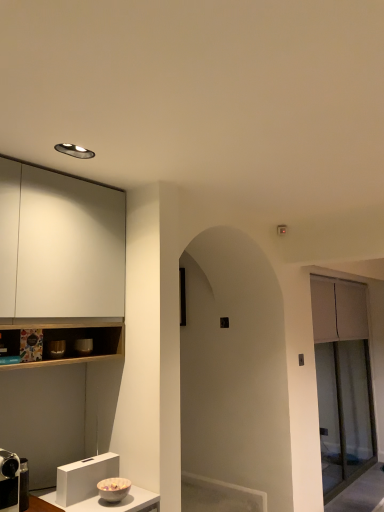
Describe the element at coordinates (83, 346) in the screenshot. This screenshot has width=384, height=512. I see `matte ceramic bowl at left, placed as the first appliance when sorted from back to front` at that location.

At what (x,y) coordinates should I click in order to perform the action: click on metallic silver camera at lower left, the 3th appliance from the back. Please return your answer as a coordinate pair (x, y). Image resolution: width=384 pixels, height=512 pixels. Looking at the image, I should click on point(13,482).

Does metallic silver camera at lower left, the 3th appliance from the right, appear on the right side of matte ceramic bowl at left, arranged as the 1th appliance when viewed from the right?

No, metallic silver camera at lower left, the 3th appliance from the right, is not to the right of matte ceramic bowl at left, arranged as the 1th appliance when viewed from the right.

From the picture: Does metallic silver camera at lower left, the 3th appliance from the back, come in front of matte ceramic bowl at left, acting as the 2th appliance starting from the bottom?

Yes, it is.

You are a GUI agent. You are given a task and a screenshot of the screen. Output one action in this format:
    pyautogui.click(x=<x>, y=<y>)
    Task: Click on the appliance below the matte ceramic bowl at left, placed as the first appliance when sorted from back to front (from the image's perspective)
    This screenshot has height=512, width=384.
    Given the screenshot: What is the action you would take?
    pyautogui.click(x=13, y=482)

Which is in front, point (8, 502) or point (54, 344)?

The point (8, 502) is closer.

Considering the sizes of metallic silver camera at lower left, the 3th appliance from the right, and matte silver bowl at left, the second appliance positioned from the back, in the image, is metallic silver camera at lower left, the 3th appliance from the right, wider or thinner than matte silver bowl at left, the second appliance positioned from the back,?

Clearly, metallic silver camera at lower left, the 3th appliance from the right, has more width compared to matte silver bowl at left, the second appliance positioned from the back.

Who is shorter, metallic silver camera at lower left, arranged as the first appliance when ordered from the bottom, or matte silver bowl at left, which appears as the second appliance when viewed from the left?

With less height is matte silver bowl at left, which appears as the second appliance when viewed from the left.

Is metallic silver camera at lower left, arranged as the first appliance when ordered from the bottom, in front of or behind matte silver bowl at left, acting as the 3th appliance starting from the bottom, in the image?

Clearly, metallic silver camera at lower left, arranged as the first appliance when ordered from the bottom, is in front of matte silver bowl at left, acting as the 3th appliance starting from the bottom.

Locate an element on the screen. the 3rd appliance in front of the clear glass screen door at right, counting from the anchor's position is located at coordinates (13, 482).

Is clear glass screen door at right not inside metallic silver camera at lower left, the 3th appliance from the back?

Indeed, clear glass screen door at right is completely outside metallic silver camera at lower left, the 3th appliance from the back.

From the picture: From a real-world perspective, who is located lower, clear glass screen door at right or metallic silver camera at lower left, which is the first appliance in front-to-back order?

From a 3D spatial view, metallic silver camera at lower left, which is the first appliance in front-to-back order, is below.

How far apart are matte ceramic bowl at left, arranged as the 3th appliance when viewed from the left, and metallic silver camera at lower left, the third appliance from the top?

matte ceramic bowl at left, arranged as the 3th appliance when viewed from the left, is 60.75 centimeters away from metallic silver camera at lower left, the third appliance from the top.

From the image's perspective, which object appears higher, matte ceramic bowl at left, placed as the first appliance when sorted from back to front, or metallic silver camera at lower left, which is the first appliance in front-to-back order?

matte ceramic bowl at left, placed as the first appliance when sorted from back to front.

Is matte ceramic bowl at left, acting as the 2th appliance starting from the bottom, positioned with its back to metallic silver camera at lower left, which is the first appliance in front-to-back order?

matte ceramic bowl at left, acting as the 2th appliance starting from the bottom, does not have its back to metallic silver camera at lower left, which is the first appliance in front-to-back order.

From the picture: From a real-world perspective, who is located lower, matte ceramic bowl at left, acting as the 2th appliance starting from the bottom, or metallic silver camera at lower left, the third appliance from the top?

metallic silver camera at lower left, the third appliance from the top.

Choose the correct answer: Is clear glass screen door at right inside matte silver bowl at left, acting as the 3th appliance starting from the bottom, or outside it?

The correct answer is: outside.

From the image's perspective, which object appears higher, clear glass screen door at right or matte silver bowl at left, the 2th appliance from the front?

matte silver bowl at left, the 2th appliance from the front, from the image's perspective.

Considering the relative sizes of clear glass screen door at right and matte silver bowl at left, the 2th appliance from the front, in the image provided, is clear glass screen door at right bigger than matte silver bowl at left, the 2th appliance from the front,?

Yes, clear glass screen door at right is bigger than matte silver bowl at left, the 2th appliance from the front.

In the scene shown: Is clear glass screen door at right facing towards matte silver bowl at left, the second appliance positioned from the back?

No, clear glass screen door at right does not turn towards matte silver bowl at left, the second appliance positioned from the back.

Which of these two, matte ceramic bowl at left, acting as the third appliance starting from the front, or clear glass screen door at right, is bigger?

clear glass screen door at right.

Considering the sizes of objects matte ceramic bowl at left, arranged as the 1th appliance when viewed from the right, and clear glass screen door at right in the image provided, who is thinner, matte ceramic bowl at left, arranged as the 1th appliance when viewed from the right, or clear glass screen door at right?

Thinner between the two is matte ceramic bowl at left, arranged as the 1th appliance when viewed from the right.

Who is shorter, matte ceramic bowl at left, acting as the 2th appliance starting from the bottom, or clear glass screen door at right?

matte ceramic bowl at left, acting as the 2th appliance starting from the bottom, is shorter.

Is matte ceramic bowl at left, arranged as the 3th appliance when viewed from the left, oriented towards clear glass screen door at right?

No, matte ceramic bowl at left, arranged as the 3th appliance when viewed from the left, is not aimed at clear glass screen door at right.

Looking at their sizes, would you say matte silver bowl at left, the 2th appliance from the front, is wider or thinner than metallic silver camera at lower left, the third appliance from the top?

matte silver bowl at left, the 2th appliance from the front, is thinner than metallic silver camera at lower left, the third appliance from the top.

Image resolution: width=384 pixels, height=512 pixels. I want to click on the 2nd appliance below the matte silver bowl at left, which appears as the second appliance when viewed from the left (from a real-world perspective), so click(x=13, y=482).

Considering the sizes of objects matte silver bowl at left, the second appliance positioned from the back, and metallic silver camera at lower left, which is the first appliance in front-to-back order, in the image provided, who is bigger, matte silver bowl at left, the second appliance positioned from the back, or metallic silver camera at lower left, which is the first appliance in front-to-back order,?

metallic silver camera at lower left, which is the first appliance in front-to-back order.

In the image, there is a matte ceramic bowl at left, placed as the first appliance when sorted from back to front. At what (x,y) coordinates should I click in order to perform the action: click on appliance below it (from the image's perspective). Please return your answer as a coordinate pair (x, y). Looking at the image, I should click on (13, 482).

From the image's perspective, starting from the metallic silver camera at lower left, the first appliance viewed from the left, which appliance is the 2nd one above? Please provide its 2D coordinates.

[(57, 349)]

Estimate the real-world distances between objects in this image. Which object is further from metallic silver camera at lower left, arranged as the first appliance when ordered from the bottom, matte ceramic bowl at left, acting as the 2th appliance starting from the bottom, or clear glass screen door at right?

Among the two, clear glass screen door at right is located further to metallic silver camera at lower left, arranged as the first appliance when ordered from the bottom.

Based on their spatial positions, is clear glass screen door at right or metallic silver camera at lower left, the third appliance from the top, closer to matte silver bowl at left, which appears as the first appliance when viewed from the top?

metallic silver camera at lower left, the third appliance from the top, lies closer to matte silver bowl at left, which appears as the first appliance when viewed from the top, than the other object.

From the image, which object appears to be farther from matte ceramic bowl at left, acting as the third appliance starting from the front, clear glass screen door at right or matte silver bowl at left, the 2th appliance from the front?

Based on the image, clear glass screen door at right appears to be further to matte ceramic bowl at left, acting as the third appliance starting from the front.

Looking at the image, which one is located closer to matte ceramic bowl at left, arranged as the 3th appliance when viewed from the left, metallic silver camera at lower left, which is the first appliance in front-to-back order, or clear glass screen door at right?

metallic silver camera at lower left, which is the first appliance in front-to-back order.

When comparing their distances from clear glass screen door at right, does metallic silver camera at lower left, arranged as the first appliance when ordered from the bottom, or matte ceramic bowl at left, arranged as the second appliance when viewed from the top, seem further?

Among the two, matte ceramic bowl at left, arranged as the second appliance when viewed from the top, is located further to clear glass screen door at right.

Estimate the real-world distances between objects in this image. Which object is closer to matte silver bowl at left, which appears as the first appliance when viewed from the top, metallic silver camera at lower left, the 3th appliance from the right, or clear glass screen door at right?

The object closer to matte silver bowl at left, which appears as the first appliance when viewed from the top, is metallic silver camera at lower left, the 3th appliance from the right.

Looking at this image, estimate the real-world distances between objects in this image. Which object is closer to clear glass screen door at right, metallic silver camera at lower left, the third appliance from the top, or matte silver bowl at left, the 2th appliance from the front?

The object closer to clear glass screen door at right is metallic silver camera at lower left, the third appliance from the top.

Which object lies nearer to the anchor point clear glass screen door at right, matte ceramic bowl at left, acting as the third appliance starting from the front, or metallic silver camera at lower left, the 3th appliance from the right?

Among the two, metallic silver camera at lower left, the 3th appliance from the right, is located nearer to clear glass screen door at right.

Find the location of a particular element. This screenshot has height=512, width=384. appliance between matte silver bowl at left, the second appliance positioned from the back, and metallic silver camera at lower left, the 3th appliance from the back, in the vertical direction is located at coordinates (83, 346).

At what (x,y) coordinates should I click in order to perform the action: click on appliance situated between matte silver bowl at left, the 2th appliance from the front, and clear glass screen door at right from left to right. Please return your answer as a coordinate pair (x, y). This screenshot has height=512, width=384. Looking at the image, I should click on (83, 346).